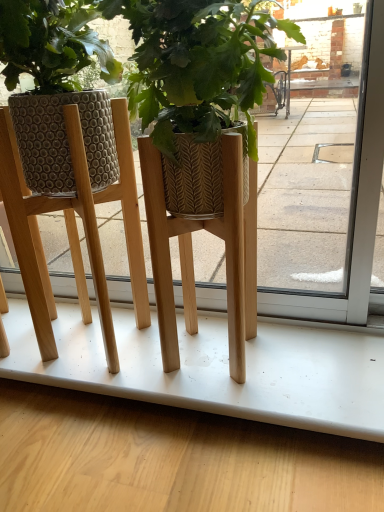
Question: From the image's perspective, is wooden floor at lower center positioned above or below wooden planter at center?

Choices:
 (A) above
 (B) below

Answer: (B)

Question: Is wooden floor at lower center wider or thinner than wooden planter at center?

Choices:
 (A) wide
 (B) thin

Answer: (B)

Question: Is wooden floor at lower center taller or shorter than wooden planter at center?

Choices:
 (A) tall
 (B) short

Answer: (B)

Question: In the image, is wooden planter at center positioned in front of or behind wooden floor at lower center?

Choices:
 (A) front
 (B) behind

Answer: (A)

Question: Is wooden planter at center bigger or smaller than wooden floor at lower center?

Choices:
 (A) big
 (B) small

Answer: (B)

Question: From a real-world perspective, is wooden planter at center positioned above or below wooden floor at lower center?

Choices:
 (A) below
 (B) above

Answer: (B)

Question: From their relative heights in the image, would you say wooden planter at center is taller or shorter than wooden floor at lower center?

Choices:
 (A) tall
 (B) short

Answer: (A)